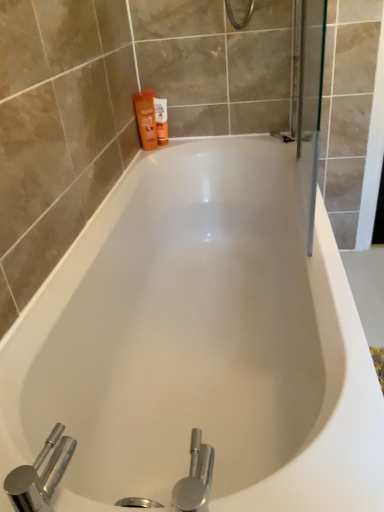
Describe the element at coordinates (40, 476) in the screenshot. I see `chrome metallic faucet at lower left` at that location.

The image size is (384, 512). Find the location of `chrome metallic faucet at lower left`. chrome metallic faucet at lower left is located at coordinates (40, 476).

What do you see at coordinates (146, 118) in the screenshot? I see `orange matte bottle at upper left, which is the 2th toiletry in right-to-left order` at bounding box center [146, 118].

Find the location of a particular element. This screenshot has height=512, width=384. orange matte lotion at upper left, which ranks as the second toiletry in left-to-right order is located at coordinates (161, 120).

Is chrome metallic faucet at lower left oriented towards white glossy bathtub at center?

Yes, chrome metallic faucet at lower left is facing white glossy bathtub at center.

Does point (45, 479) come in front of point (162, 309)?

That is True.

Is chrome metallic faucet at lower left spatially inside white glossy bathtub at center, or outside of it?

chrome metallic faucet at lower left cannot be found inside white glossy bathtub at center.

Which object is thinner, chrome metallic faucet at lower left or white glossy bathtub at center?

Thinner between the two is chrome metallic faucet at lower left.

Considering the relative positions of orange matte lotion at upper left, which is the first toiletry from right to left, and orange matte bottle at upper left, placed as the 1th toiletry when sorted from left to right, in the image provided, is orange matte lotion at upper left, which is the first toiletry from right to left, to the left or to the right of orange matte bottle at upper left, placed as the 1th toiletry when sorted from left to right,?

In the image, orange matte lotion at upper left, which is the first toiletry from right to left, appears on the right side of orange matte bottle at upper left, placed as the 1th toiletry when sorted from left to right.

How different are the orientations of orange matte lotion at upper left, which is the first toiletry from right to left, and orange matte bottle at upper left, placed as the 1th toiletry when sorted from left to right, in degrees?

0.00175 degrees.

Is orange matte lotion at upper left, which ranks as the second toiletry in left-to-right order, far from orange matte bottle at upper left, placed as the 1th toiletry when sorted from left to right?

Actually, orange matte lotion at upper left, which ranks as the second toiletry in left-to-right order, and orange matte bottle at upper left, placed as the 1th toiletry when sorted from left to right, are a little close together.

From a real-world perspective, is orange matte lotion at upper left, which ranks as the second toiletry in left-to-right order, above or below orange matte bottle at upper left, which is the 2th toiletry in right-to-left order?

Clearly, from a real-world perspective, orange matte lotion at upper left, which ranks as the second toiletry in left-to-right order, is below orange matte bottle at upper left, which is the 2th toiletry in right-to-left order.

Considering the relative sizes of orange matte lotion at upper left, which ranks as the second toiletry in left-to-right order, and white glossy bathtub at center in the image provided, is orange matte lotion at upper left, which ranks as the second toiletry in left-to-right order, thinner than white glossy bathtub at center?

Yes.

How much distance is there between orange matte lotion at upper left, which is the first toiletry from right to left, and white glossy bathtub at center?

orange matte lotion at upper left, which is the first toiletry from right to left, is 30.60 inches away from white glossy bathtub at center.

Is orange matte lotion at upper left, which ranks as the second toiletry in left-to-right order, aimed at white glossy bathtub at center?

No, orange matte lotion at upper left, which ranks as the second toiletry in left-to-right order, is not aimed at white glossy bathtub at center.

From a real-world perspective, who is located lower, chrome metallic faucet at lower left or orange matte lotion at upper left, which ranks as the second toiletry in left-to-right order?

From a 3D spatial view, chrome metallic faucet at lower left is below.

Is chrome metallic faucet at lower left positioned in front of orange matte lotion at upper left, which ranks as the second toiletry in left-to-right order?

Yes, chrome metallic faucet at lower left is closer to the viewer.

From the image's perspective, which one is positioned lower, chrome metallic faucet at lower left or orange matte lotion at upper left, which ranks as the second toiletry in left-to-right order?

chrome metallic faucet at lower left, from the image's perspective.

Which is nearer, (50, 482) or (160, 105)?

The point (50, 482) is in front.

Does orange matte lotion at upper left, which is the first toiletry from right to left, come behind chrome metallic faucet at lower left?

Yes, it is behind chrome metallic faucet at lower left.

From the image's perspective, between orange matte lotion at upper left, which is the first toiletry from right to left, and chrome metallic faucet at lower left, who is located below?

chrome metallic faucet at lower left.

From a real-world perspective, relative to chrome metallic faucet at lower left, is orange matte lotion at upper left, which is the first toiletry from right to left, vertically above or below?

From a real-world perspective, orange matte lotion at upper left, which is the first toiletry from right to left, is physically above chrome metallic faucet at lower left.

Can you confirm if orange matte lotion at upper left, which is the first toiletry from right to left, is positioned to the left of chrome metallic faucet at lower left?

No, orange matte lotion at upper left, which is the first toiletry from right to left, is not to the left of chrome metallic faucet at lower left.

Consider the image. Would you say chrome metallic faucet at lower left is a long distance from orange matte bottle at upper left, which is the 2th toiletry in right-to-left order?

Yes, chrome metallic faucet at lower left is far from orange matte bottle at upper left, which is the 2th toiletry in right-to-left order.

Looking at this image, do you think chrome metallic faucet at lower left is within orange matte bottle at upper left, placed as the 1th toiletry when sorted from left to right, or outside of it?

chrome metallic faucet at lower left lies outside orange matte bottle at upper left, placed as the 1th toiletry when sorted from left to right.

Based on the photo, which of these two, chrome metallic faucet at lower left or orange matte bottle at upper left, which is the 2th toiletry in right-to-left order, stands shorter?

With less height is chrome metallic faucet at lower left.

Is white glossy bathtub at center with chrome metallic faucet at lower left?

There is a gap between white glossy bathtub at center and chrome metallic faucet at lower left.

From the image's perspective, between white glossy bathtub at center and chrome metallic faucet at lower left, who is located below?

From the image's view, chrome metallic faucet at lower left is below.

How different are the orientations of white glossy bathtub at center and chrome metallic faucet at lower left in degrees?

89.5 degrees.

Locate an element on the screen. bathtub above the chrome metallic faucet at lower left (from the image's perspective) is located at coordinates (199, 343).

This screenshot has width=384, height=512. What are the coordinates of `tap in front of the white glossy bathtub at center` in the screenshot? It's located at (40, 476).

You are a GUI agent. You are given a task and a screenshot of the screen. Output one action in this format:
    pyautogui.click(x=<x>, y=<y>)
    Task: Click on the toiletry positioned vertically above the orange matte lotion at upper left, which is the first toiletry from right to left (from a real-world perspective)
    
    Given the screenshot: What is the action you would take?
    pyautogui.click(x=146, y=118)

From the image, which object appears to be nearer to white glossy bathtub at center, orange matte lotion at upper left, which ranks as the second toiletry in left-to-right order, or chrome metallic faucet at lower left?

chrome metallic faucet at lower left lies closer to white glossy bathtub at center than the other object.

From the image, which object appears to be nearer to orange matte bottle at upper left, placed as the 1th toiletry when sorted from left to right, orange matte lotion at upper left, which ranks as the second toiletry in left-to-right order, or white glossy bathtub at center?

orange matte lotion at upper left, which ranks as the second toiletry in left-to-right order.

Which object lies nearer to the anchor point orange matte lotion at upper left, which ranks as the second toiletry in left-to-right order, orange matte bottle at upper left, placed as the 1th toiletry when sorted from left to right, or chrome metallic faucet at lower left?

Among the two, orange matte bottle at upper left, placed as the 1th toiletry when sorted from left to right, is located nearer to orange matte lotion at upper left, which ranks as the second toiletry in left-to-right order.

Based on their spatial positions, is white glossy bathtub at center or orange matte bottle at upper left, placed as the 1th toiletry when sorted from left to right, further from chrome metallic faucet at lower left?

Based on the image, orange matte bottle at upper left, placed as the 1th toiletry when sorted from left to right, appears to be further to chrome metallic faucet at lower left.

Which object lies further to the anchor point chrome metallic faucet at lower left, orange matte bottle at upper left, which is the 2th toiletry in right-to-left order, or white glossy bathtub at center?

orange matte bottle at upper left, which is the 2th toiletry in right-to-left order, is further to chrome metallic faucet at lower left.

When comparing their distances from white glossy bathtub at center, does orange matte bottle at upper left, placed as the 1th toiletry when sorted from left to right, or chrome metallic faucet at lower left seem closer?

chrome metallic faucet at lower left is closer to white glossy bathtub at center.

Considering their positions, is orange matte lotion at upper left, which is the first toiletry from right to left, positioned closer to chrome metallic faucet at lower left than white glossy bathtub at center?

white glossy bathtub at center is positioned closer to the anchor chrome metallic faucet at lower left.

Estimate the real-world distances between objects in this image. Which object is closer to orange matte bottle at upper left, which is the 2th toiletry in right-to-left order, orange matte lotion at upper left, which is the first toiletry from right to left, or chrome metallic faucet at lower left?

orange matte lotion at upper left, which is the first toiletry from right to left, is closer to orange matte bottle at upper left, which is the 2th toiletry in right-to-left order.

This screenshot has height=512, width=384. Identify the location of toiletry between chrome metallic faucet at lower left and orange matte lotion at upper left, which ranks as the second toiletry in left-to-right order, from front to back. (146, 118).

The image size is (384, 512). What are the coordinates of `toiletry between white glossy bathtub at center and orange matte lotion at upper left, which is the first toiletry from right to left, in the front-back direction` in the screenshot? It's located at (146, 118).

Where is `bathtub between chrome metallic faucet at lower left and orange matte bottle at upper left, placed as the 1th toiletry when sorted from left to right, from front to back`? The height and width of the screenshot is (512, 384). bathtub between chrome metallic faucet at lower left and orange matte bottle at upper left, placed as the 1th toiletry when sorted from left to right, from front to back is located at coordinates (199, 343).

This screenshot has height=512, width=384. I want to click on bathtub located between chrome metallic faucet at lower left and orange matte lotion at upper left, which is the first toiletry from right to left, in the depth direction, so click(x=199, y=343).